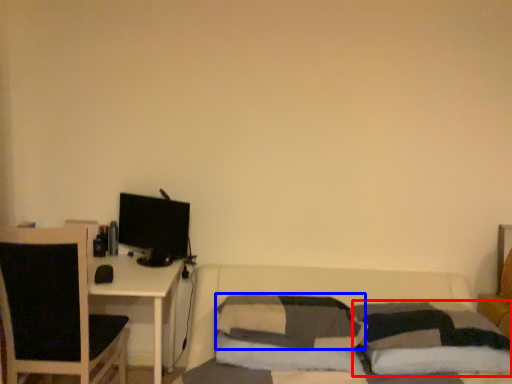
Question: Which of the following is the closest to the observer, pillow (highlighted by a red box) or pillow (highlighted by a blue box)?

Choices:
 (A) pillow
 (B) pillow

Answer: (A)